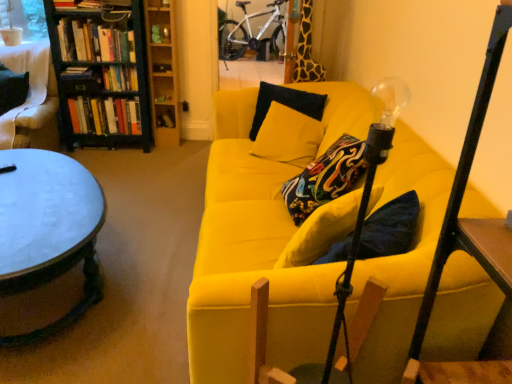
Question: Is point 166,74 positioned closer to the camera than point 207,291?

Choices:
 (A) closer
 (B) farther

Answer: (B)

Question: Is wooden bookcase at upper center, which is the first bookcase in right-to-left order, inside or outside of yellow fabric couch at center?

Choices:
 (A) inside
 (B) outside

Answer: (B)

Question: Which object is positioned closest to the black wood bookcase at left, which is the second bookcase from right to left?

Choices:
 (A) hardcover books at left, which appears as the 4th book when viewed from the top
 (B) yellow fabric couch at center
 (C) white fabric chair at upper left
 (D) white matte bicycle at upper center
 (E) hardcover books at upper left, which is counted as the first book, starting from the top

Answer: (E)

Question: Considering the real-world distances, which object is closest to the hardcover books at upper left, acting as the third book starting from the top?

Choices:
 (A) wooden bookcase at upper center, which is the first bookcase in right-to-left order
 (B) white matte bicycle at upper center
 (C) hardcover books at upper left, which is counted as the fifth book, starting from the bottom
 (D) black matte pillow at center
 (E) yellow fabric couch at center

Answer: (C)